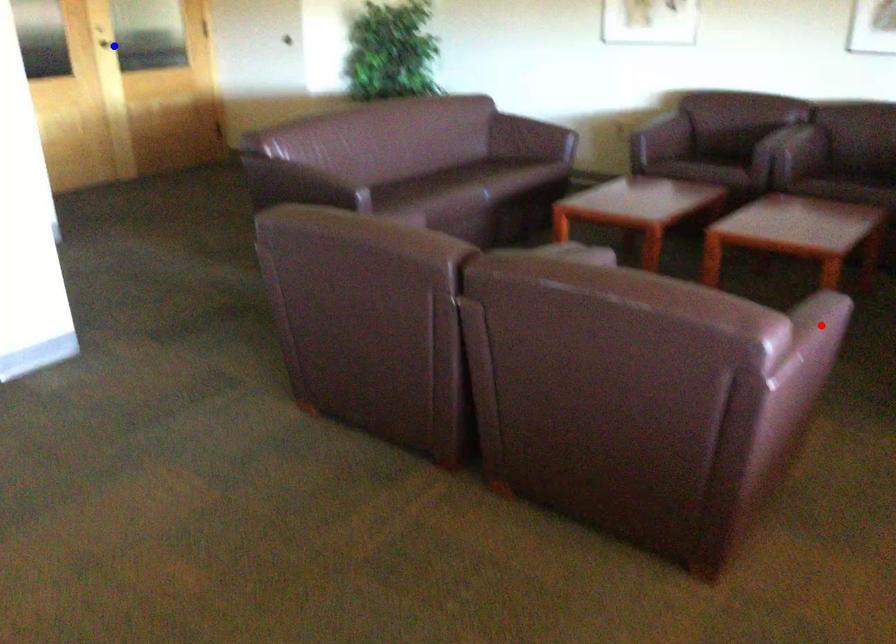
Question: Which of the two points in the image is closer to the camera?

Choices:
 (A) Blue point is closer.
 (B) Red point is closer.

Answer: (B)